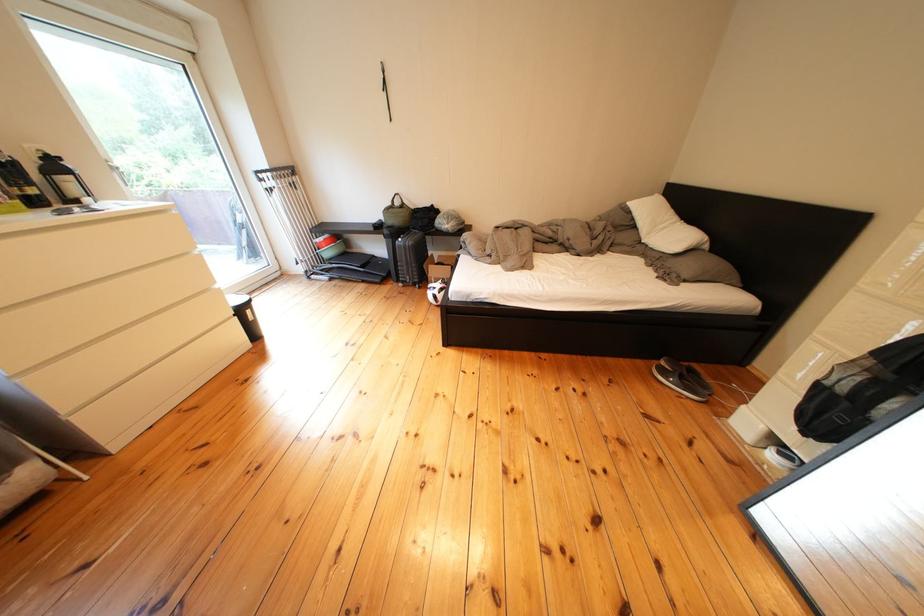
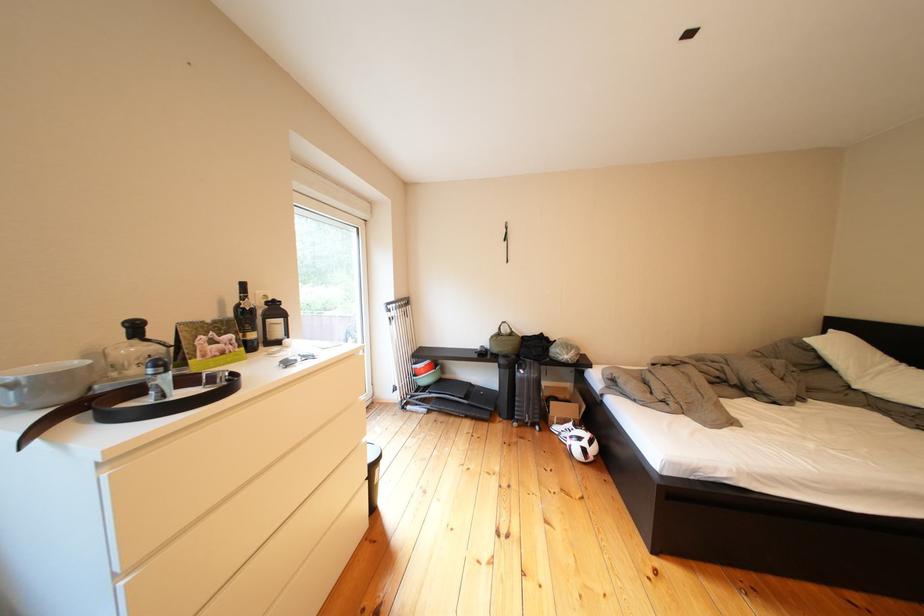
In the second image, find the point that corresponds to (399,236) in the first image.

(516, 366)